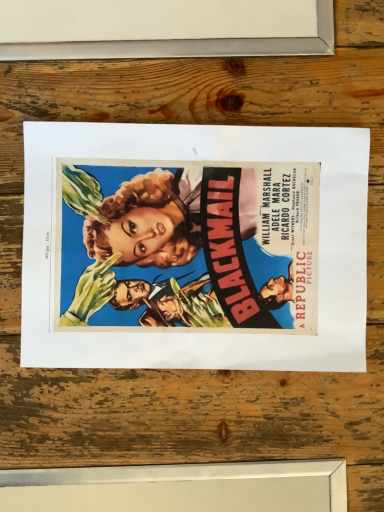
What is the approximate height of vibrant paper poster at center?

The height of vibrant paper poster at center is 0.41 inches.

What do you see at coordinates (206, 332) in the screenshot? The width and height of the screenshot is (384, 512). I see `vibrant paper poster at center` at bounding box center [206, 332].

I want to click on vibrant paper poster at center, so click(x=206, y=332).

At what (x,y) coordinates should I click in order to perform the action: click on vibrant paper poster at center. Please return your answer as a coordinate pair (x, y). The height and width of the screenshot is (512, 384). Looking at the image, I should click on (206, 332).